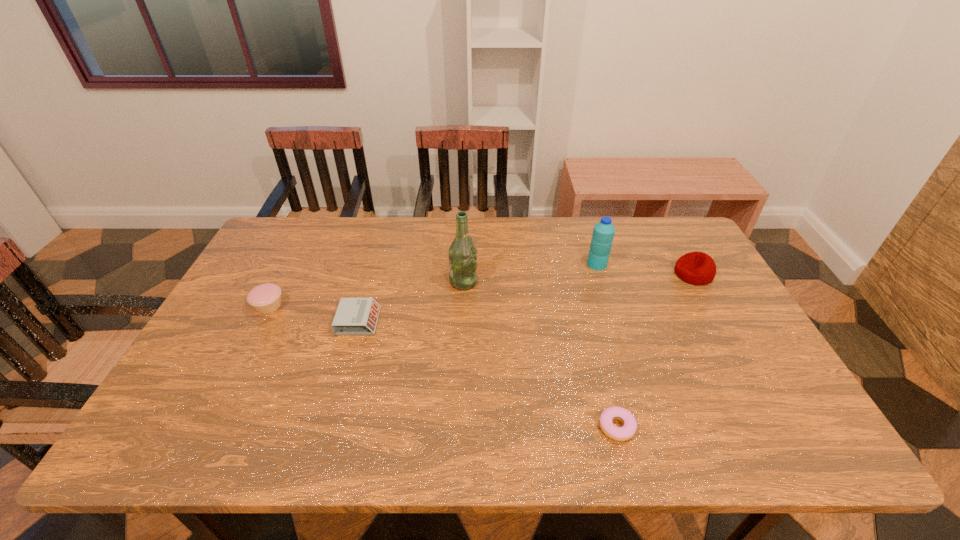
Identify the location of free space between the tallest object and the fifth object from right to left. The height and width of the screenshot is (540, 960). tap(411, 301).

The width and height of the screenshot is (960, 540). Identify the location of free point between the rightmost object and the leftmost object. (481, 290).

Identify the location of unoccupied position between the rightmost object and the doughnut. The height and width of the screenshot is (540, 960). (655, 350).

I want to click on vacant point located between the fifth tallest object and the fourth shortest object, so click(x=526, y=298).

The image size is (960, 540). Identify the location of free spot between the water bottle and the second shortest object. (477, 293).

The image size is (960, 540). In order to click on vacant space that is in between the beer bottle and the third tallest object in this screenshot , I will do `click(579, 278)`.

This screenshot has width=960, height=540. Identify the location of free space between the fifth object from right to left and the shortest object. click(x=488, y=374).

This screenshot has width=960, height=540. I want to click on free spot between the beanbag and the nearest object, so click(655, 350).

At what (x,y) coordinates should I click in order to perform the action: click on object that stands as the second closest to the nearest object. Please return your answer as a coordinate pair (x, y). This screenshot has width=960, height=540. Looking at the image, I should click on (697, 268).

Choose which object is the nearest neighbor to the fourth tallest object. Please provide its 2D coordinates. Your answer should be formatted as a tuple, i.e. [(x, y)], where the tuple contains the x and y coordinates of a point satisfying the conditions above.

[(355, 316)]